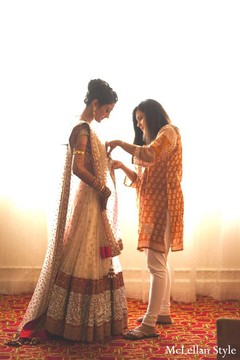
The height and width of the screenshot is (360, 240). What are the coordinates of `red decorative frill` in the screenshot? It's located at (107, 250).